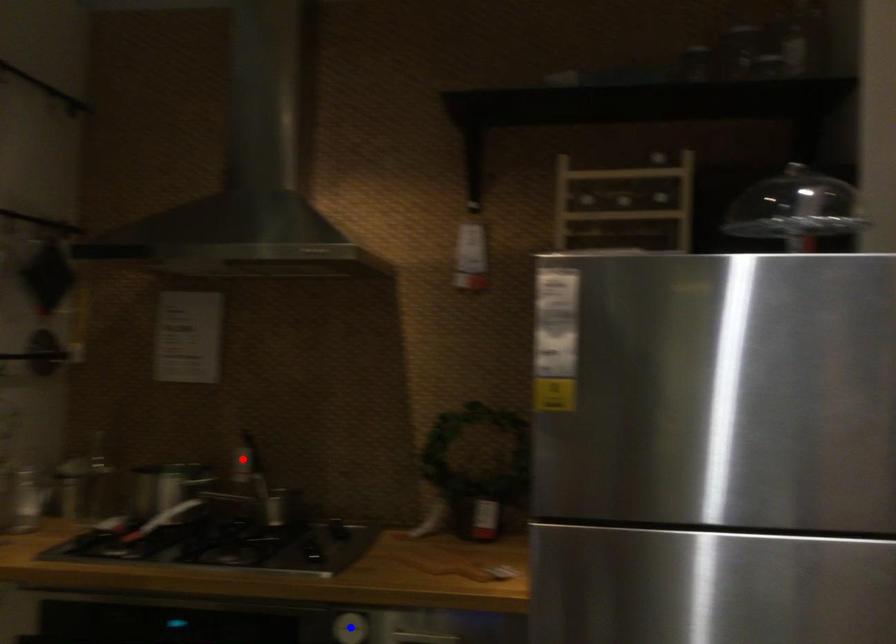
Question: In the image, two points are highlighted. Which point is nearer to the camera? Reply with the corresponding letter.

Choices:
 (A) blue point
 (B) red point

Answer: (A)